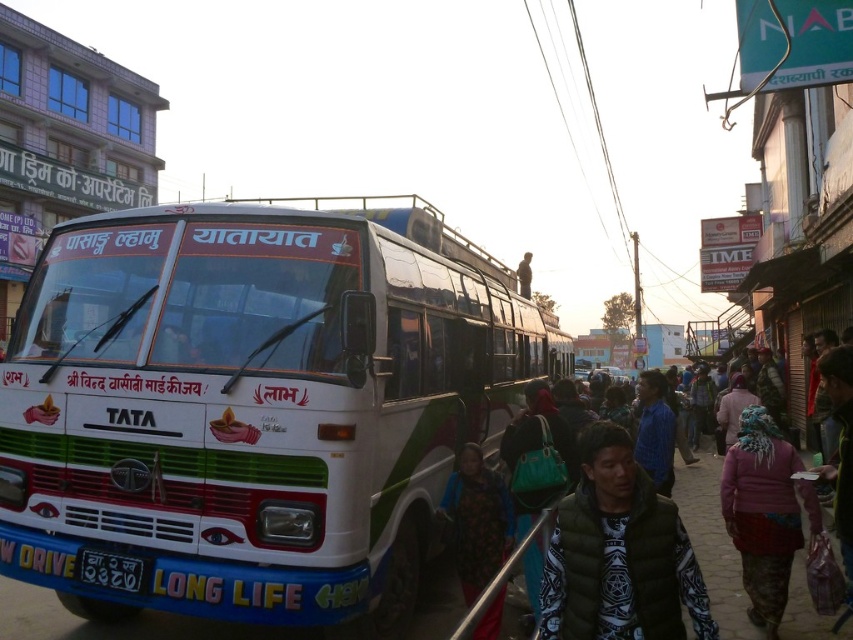
You are a tailor observing a busy street scene with a dark green vest at center and a floral fabric shawl at center. Which clothing item is smaller in size?

The dark green vest at center is smaller than the floral fabric shawl at center.

You are a pedestrian standing on the street and notice two items in the scene. One is the dark green vest at center and the other is the white plastic license plate at lower left. Which of these two items is wider?

The dark green vest at center is wider than the white plastic license plate at lower left.